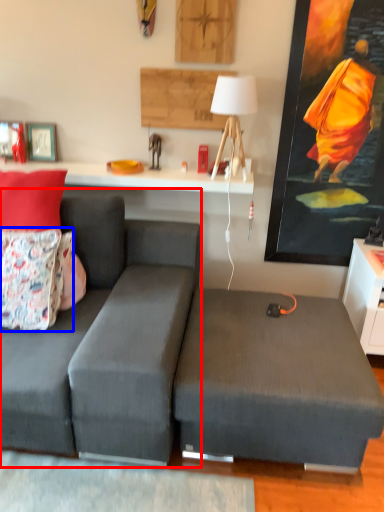
Question: Which of the following is the closest to the observer, couch (highlighted by a red box) or pillow (highlighted by a blue box)?

Choices:
 (A) couch
 (B) pillow

Answer: (A)